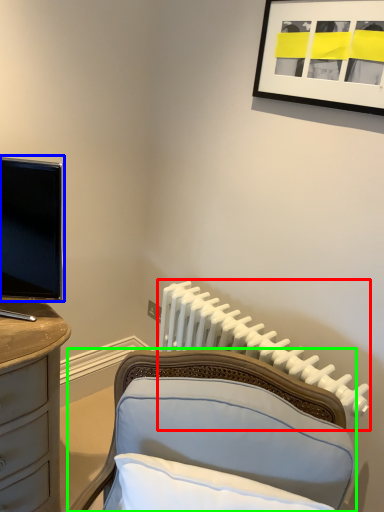
Question: Which object is positioned farthest from radiator (highlighted by a red box)? Select from television (highlighted by a blue box) and furniture (highlighted by a green box).

Choices:
 (A) television
 (B) furniture

Answer: (A)